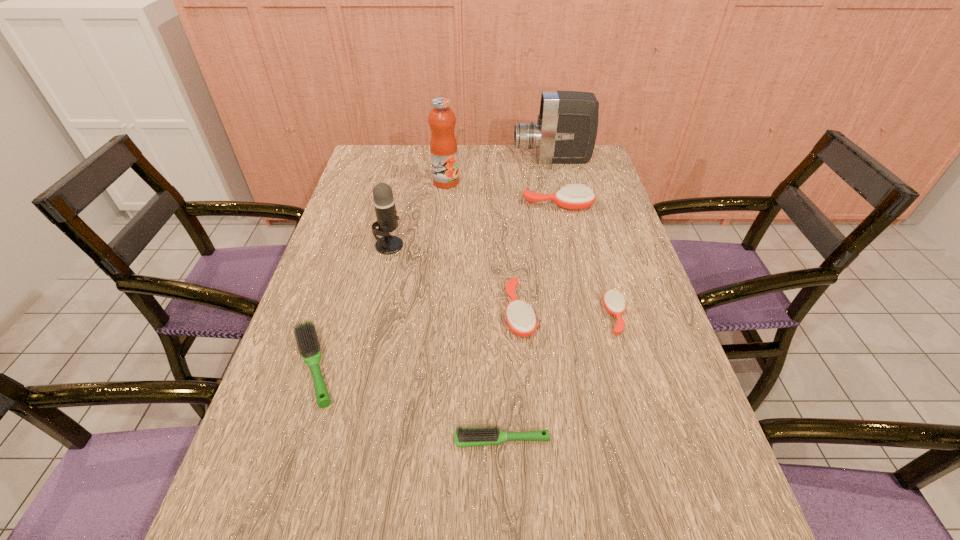
Locate an element on the screen. The width and height of the screenshot is (960, 540). free space at the far edge of the desktop is located at coordinates (478, 153).

In the image, there is a desktop. Identify the location of vacant space at the left edge. (363, 300).

Identify the location of vacant space at the right edge. This screenshot has height=540, width=960. (650, 403).

At what (x,y) coordinates should I click in order to perform the action: click on free space at the far left corner. Please return your answer as a coordinate pair (x, y). The image size is (960, 540). Looking at the image, I should click on (396, 155).

At what (x,y) coordinates should I click in order to perform the action: click on vacant area between the fruit juice and the smaller light hairbrush. Please return your answer as a coordinate pair (x, y). This screenshot has width=960, height=540. Looking at the image, I should click on (473, 311).

Locate an element on the screen. This screenshot has width=960, height=540. empty location between the smaller light hairbrush and the gray microphone is located at coordinates (445, 342).

Locate an element on the screen. Image resolution: width=960 pixels, height=540 pixels. vacant area that lies between the camcorder and the sixth object from right to left is located at coordinates (499, 171).

Identify the location of vacant space that is in between the farthest object and the seventh nearest object. The image size is (960, 540). (499, 171).

What are the coordinates of `free space that is in between the leftmost orange hairbrush and the farthest object` in the screenshot? It's located at (536, 236).

I want to click on free spot between the seventh nearest object and the third tallest object, so click(418, 214).